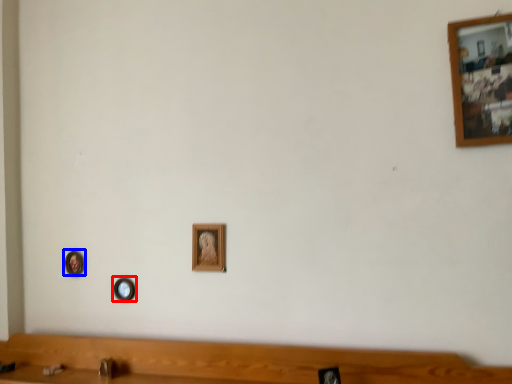
Question: Which point is closer to the camera, picture frame (highlighted by a red box) or picture frame (highlighted by a blue box)?

Choices:
 (A) picture frame
 (B) picture frame

Answer: (A)